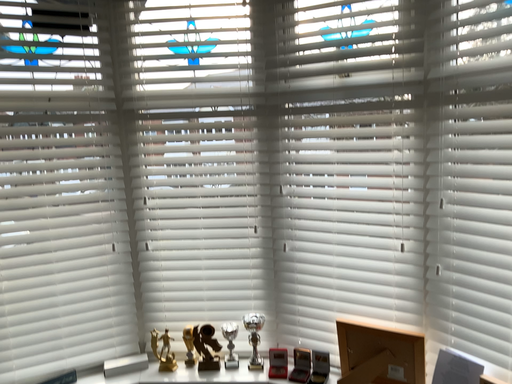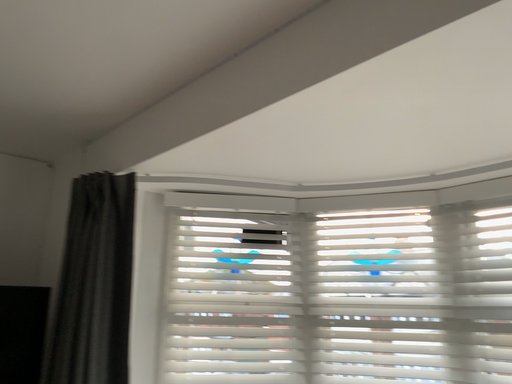
Question: How did the camera likely rotate when shooting the video?

Choices:
 (A) rotated left
 (B) rotated right

Answer: (A)